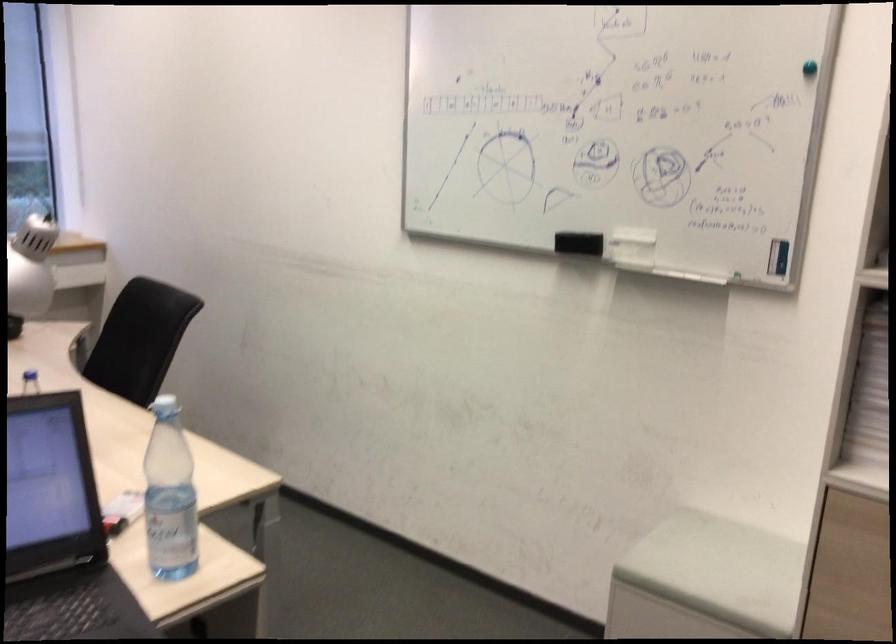
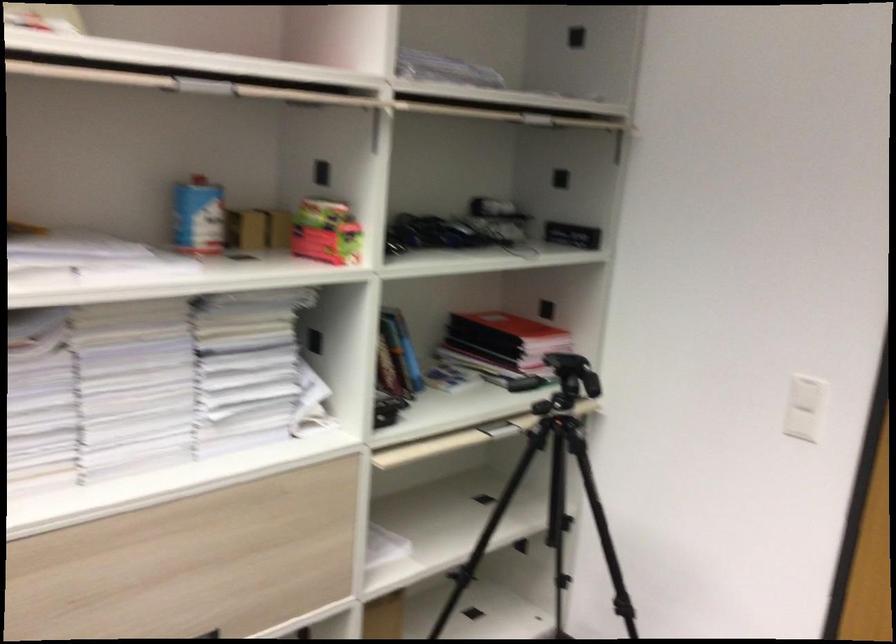
Question: How did the camera likely rotate?

Choices:
 (A) Left
 (B) Right
 (C) Up
 (D) Down

Answer: (B)